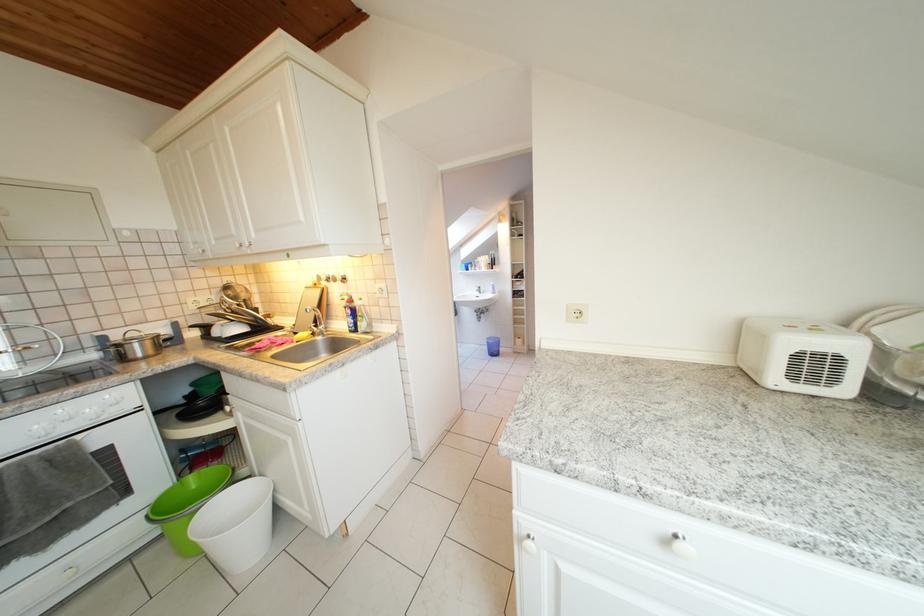
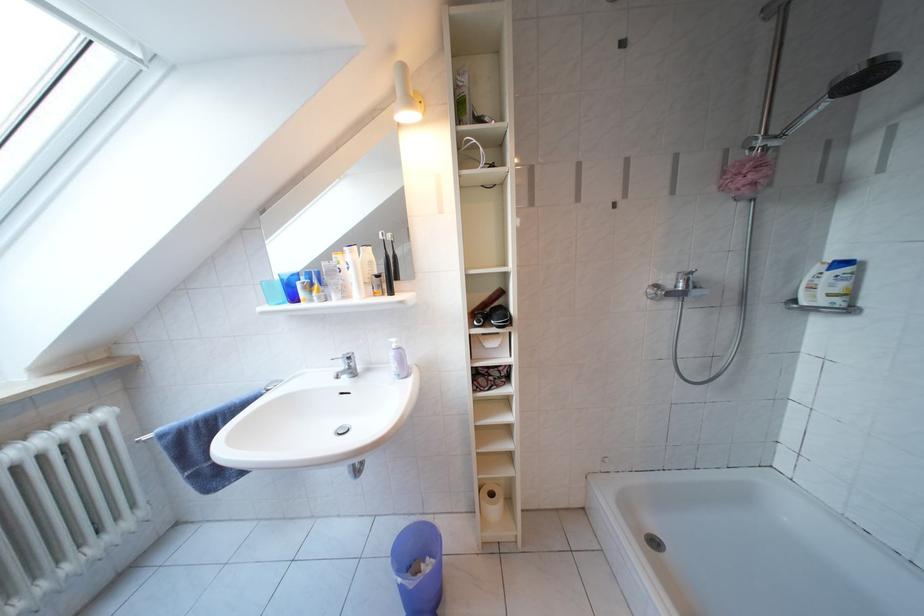
Question: In a continuous first-person perspective shot, in which direction is the camera moving?

Choices:
 (A) Left
 (B) Right
 (C) Forward
 (D) Backward

Answer: (C)